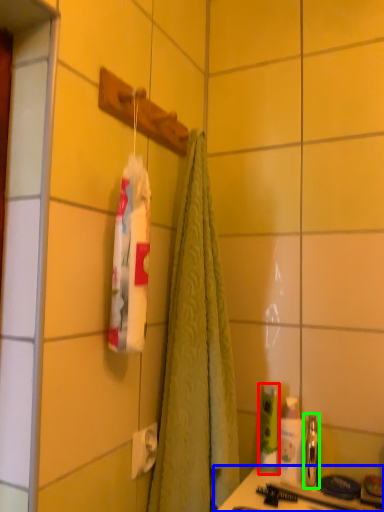
Question: Considering the real-world distances, which object is farthest from mouthwash (highlighted by a red box)? counter (highlighted by a blue box) or mouthwash (highlighted by a green box)?

Choices:
 (A) counter
 (B) mouthwash

Answer: (A)